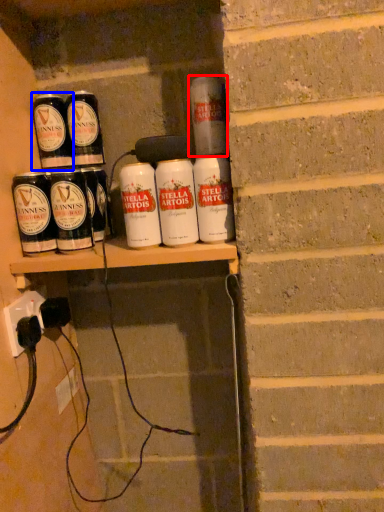
Question: Among these objects, which one is farthest to the camera, tin can (highlighted by a red box) or tin can (highlighted by a blue box)?

Choices:
 (A) tin can
 (B) tin can

Answer: (B)